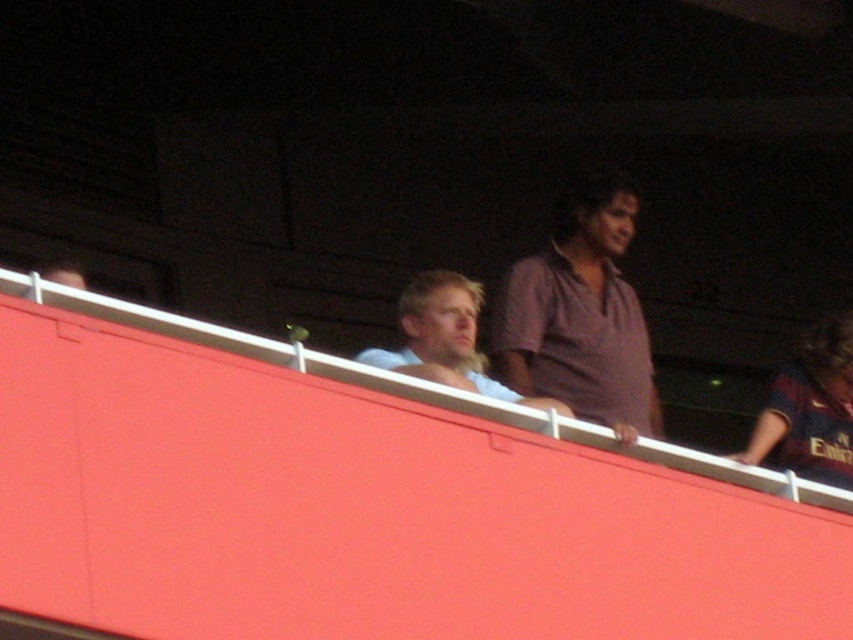
You are a photographer trying to capture a photo of the purple cotton shirt at upper right and the light blue shirt at center. Since you want both shirts to be in focus, you need to know which one is taller. Which shirt has a greater height?

The purple cotton shirt at upper right has a greater height compared to the light blue shirt at center.

You are a photographer trying to capture a photo of the two people behind the red barrier. You notice two points marked on your viewfinder at coordinates point (784, 368) and point (396, 368). Which point is closer to your camera lens?

Point (784, 368) is further to the camera than point (396, 368), so the point closer to the camera lens is point (396, 368).